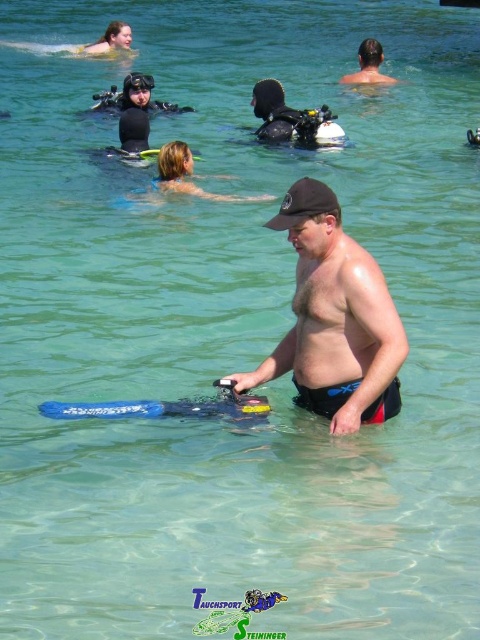
From the picture: Which of these two, matte black cap at center or black matte scuba gear at center, stands shorter?

With less height is black matte scuba gear at center.

The image size is (480, 640). What do you see at coordinates (334, 320) in the screenshot?
I see `matte black cap at center` at bounding box center [334, 320].

Locate an element on the screen. matte black cap at center is located at coordinates (334, 320).

Does point (300, 145) come in front of point (128, 74)?

Yes, it is.

Is black matte scuba gear at center wider than black matte snorkel mask at upper center?

Yes, black matte scuba gear at center is wider than black matte snorkel mask at upper center.

Is point (330, 131) behind point (136, 88)?

No, it is not.

Locate an element on the screen. black matte scuba gear at center is located at coordinates (291, 120).

Does matte black cap at center have a greater height compared to black matte snorkel mask at upper center?

Yes.

I want to click on matte black cap at center, so click(334, 320).